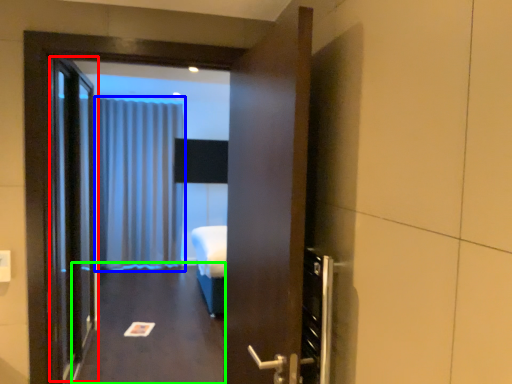
Question: Which object is the farthest from elevator door (highlighted by a red box)? Choose among these: curtain (highlighted by a blue box) or corridor (highlighted by a green box).

Choices:
 (A) curtain
 (B) corridor

Answer: (A)